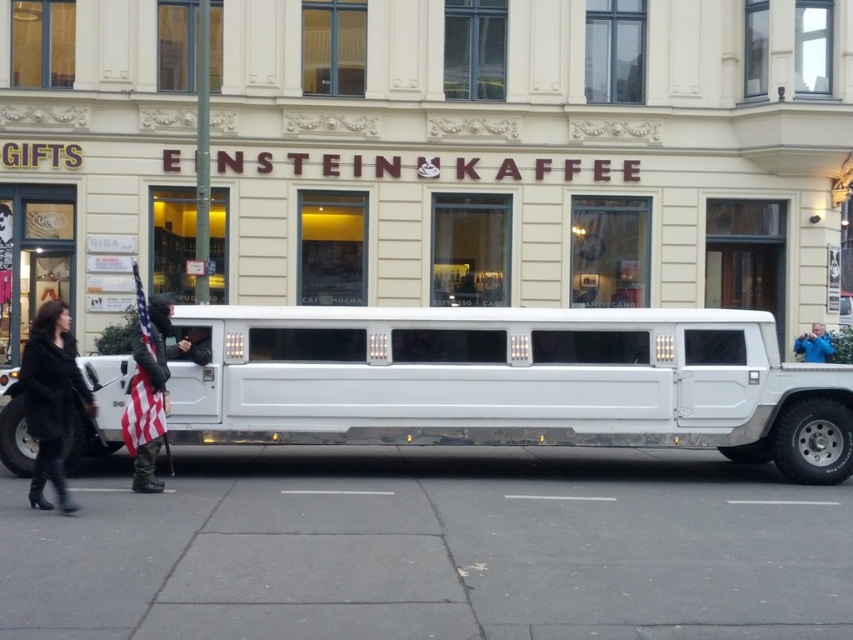
You are standing at the point labeled point (57, 486) and want to walk to the nearest building entrance. The entrance is located 20 feet away from your current position. Can you safely walk straight ahead without crossing any obstacles?

The point labeled point (57, 486) is 31.71 feet away from the viewer. Since the entrance is only 20 feet away from your current position, you would need to walk towards the entrance, which is closer than your current distance from the viewer. However, the question mentions obstacles, but the scene description does not mention any obstacles between the point and the entrance. Therefore, assuming no obstacles, you can walk straight ahead safely.

You are a photographer trying to capture a shot of the black leather coat at lower left and the blue fabric jacket at center. Which of the two items takes up more area in the photo?

The blue fabric jacket at center occupies more space in the photo than the black leather coat at lower left.